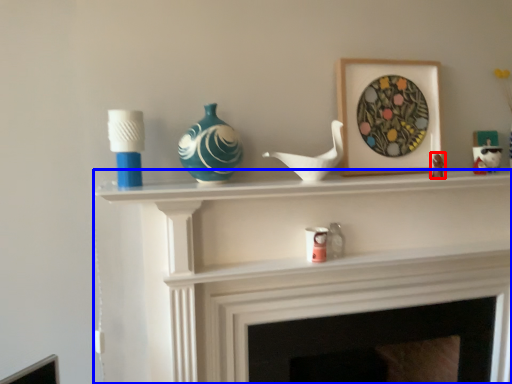
Question: Among these objects, which one is nearest to the camera, toy (highlighted by a red box) or shelf (highlighted by a blue box)?

Choices:
 (A) toy
 (B) shelf

Answer: (B)